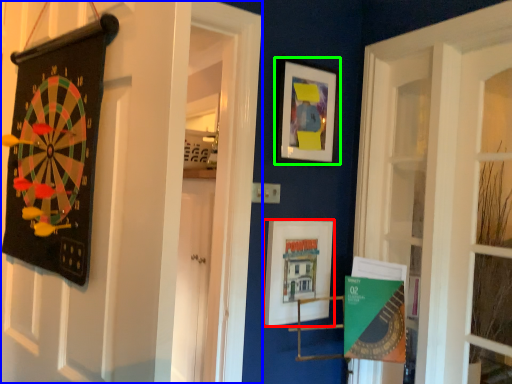
Question: Which object is positioned farthest from picture frame (highlighted by a red box)? Select from door (highlighted by a blue box) and picture frame (highlighted by a green box).

Choices:
 (A) door
 (B) picture frame

Answer: (A)